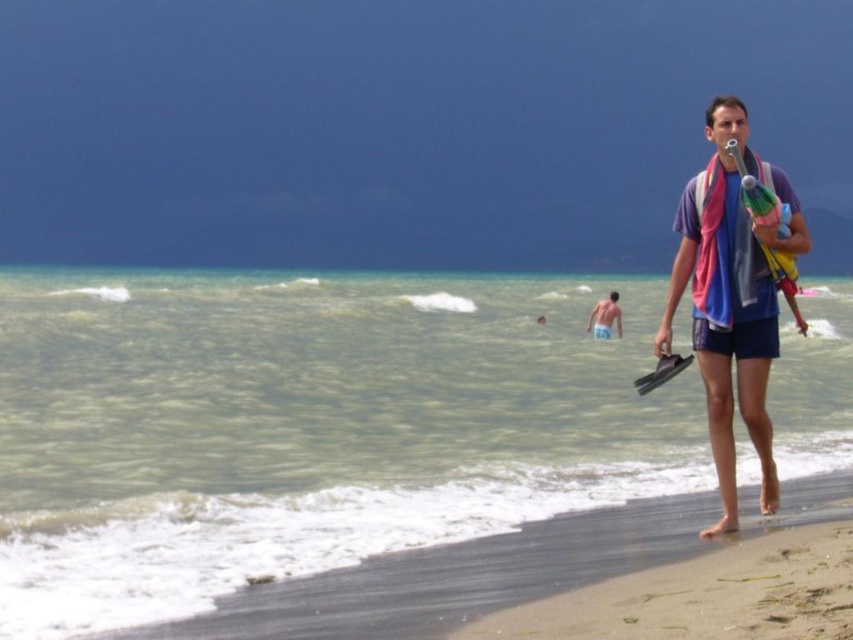
Question: Observing the image, what is the correct spatial positioning of blue cotton shorts at right in reference to light blue fabric at center?

Choices:
 (A) above
 (B) below

Answer: (A)

Question: Can you confirm if brown sandy beach at lower right is positioned below light blue fabric at center?

Choices:
 (A) yes
 (B) no

Answer: (A)

Question: Among these points, which one is nearest to the camera?

Choices:
 (A) (608, 320)
 (B) (711, 632)
 (C) (314, 308)
 (D) (741, 180)

Answer: (B)

Question: Is brown sandy beach at lower right to the right of yellow rubber paddle at right from the viewer's perspective?

Choices:
 (A) yes
 (B) no

Answer: (B)

Question: Among these objects, which one is farthest from the camera?

Choices:
 (A) yellow rubber paddle at right
 (B) light blue fabric at center

Answer: (B)

Question: Which point is closer to the camera?

Choices:
 (A) (471, 280)
 (B) (780, 625)
 (C) (770, 268)

Answer: (B)